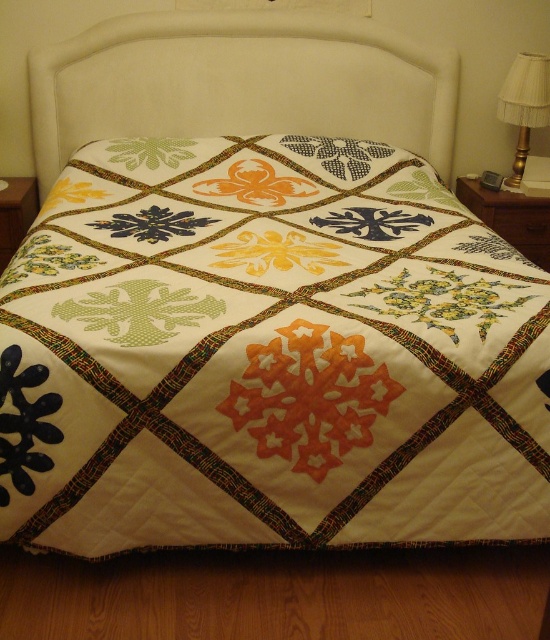
Question: Estimate the real-world distances between objects in this image. Which object is closer to the white fabric headboard at upper center?

Choices:
 (A) orange fabric snowflake at center
 (B) gold metallic lampshade at right
 (C) white quilt with colorful patterns at center
 (D) black fabric flower at lower left

Answer: (B)

Question: Can you confirm if orange fabric snowflake at center is positioned to the left of gold metallic lampshade at right?

Choices:
 (A) no
 (B) yes

Answer: (B)

Question: Can you confirm if white quilt with colorful patterns at center is smaller than black fabric flower at lower left?

Choices:
 (A) yes
 (B) no

Answer: (B)

Question: Is white quilt with colorful patterns at center wider than white fabric headboard at upper center?

Choices:
 (A) yes
 (B) no

Answer: (B)

Question: Estimate the real-world distances between objects in this image. Which object is closer to the gold metallic lampshade at right?

Choices:
 (A) black fabric flower at lower left
 (B) orange fabric snowflake at center
 (C) white fabric headboard at upper center

Answer: (C)

Question: Which object is the closest to the black fabric flower at lower left?

Choices:
 (A) white quilt with colorful patterns at center
 (B) white fabric headboard at upper center

Answer: (A)